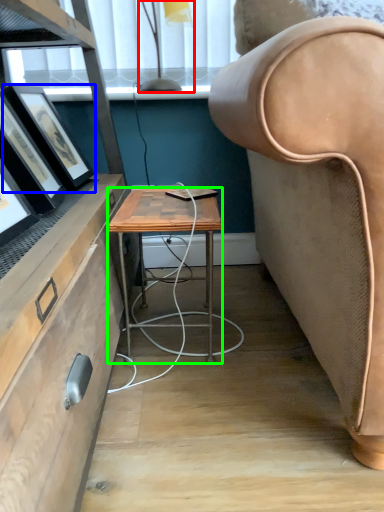
Question: Based on their relative distances, which object is farther from lamp (highlighted by a red box)? Choose from picture frame (highlighted by a blue box) and desk (highlighted by a green box).

Choices:
 (A) picture frame
 (B) desk

Answer: (B)